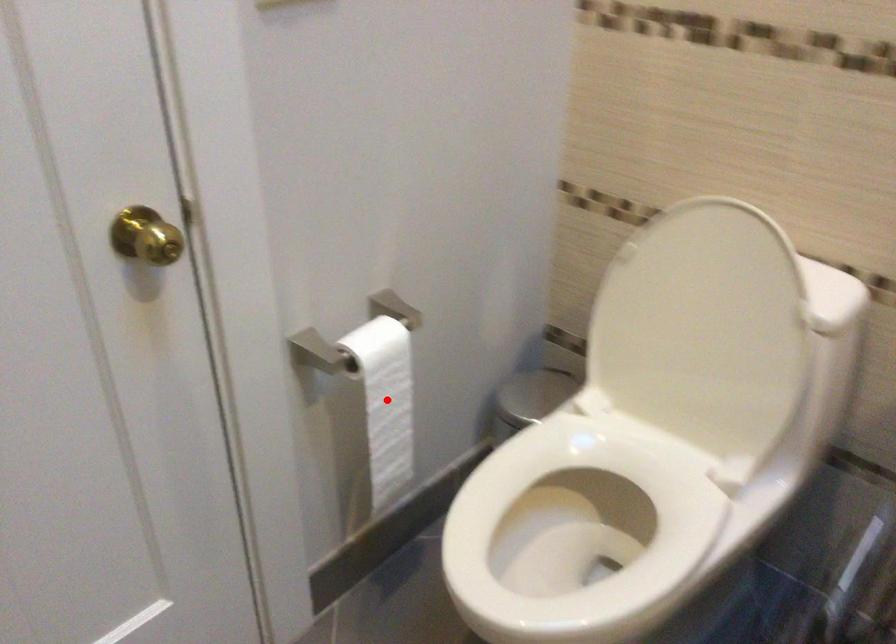
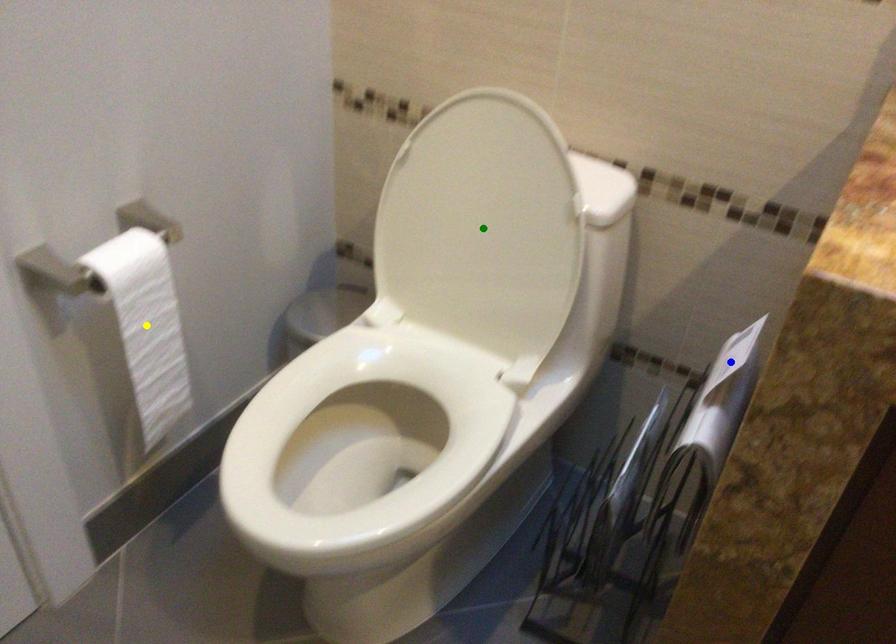
Question: I am providing you with two images of the same scene from different viewpoints. A red point is marked on the first image. You are given multiple points on the second image. Which mark in image 2 goes with the point in image 1?

Choices:
 (A) green point
 (B) yellow point
 (C) blue point

Answer: (B)